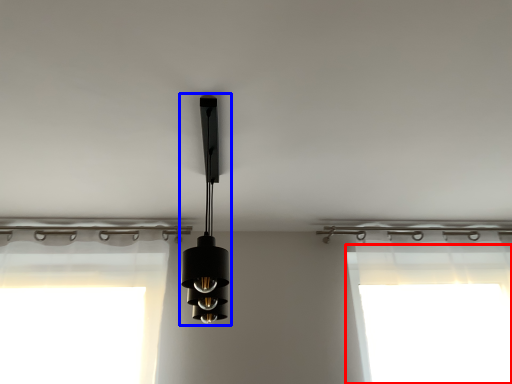
Question: Which of the following is the closest to the observer, window screen (highlighted by a red box) or lamp (highlighted by a blue box)?

Choices:
 (A) window screen
 (B) lamp

Answer: (B)